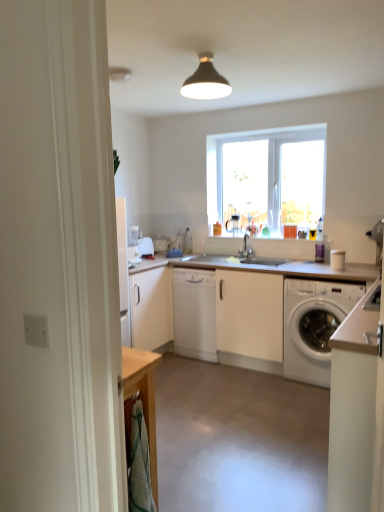
Question: Is white matte cabinet at center, which is counted as the second cabinetry, starting from the right, taller than white matte countertop at center?

Choices:
 (A) yes
 (B) no

Answer: (B)

Question: From a real-world perspective, is white matte cabinet at center, which is the 2th cabinetry from front to back, beneath white matte countertop at center?

Choices:
 (A) yes
 (B) no

Answer: (A)

Question: Is white matte cabinet at center, the first cabinetry from the back, closer to camera compared to white matte countertop at center?

Choices:
 (A) yes
 (B) no

Answer: (B)

Question: Is the depth of white matte cabinet at center, which ranks as the 1th cabinetry in left-to-right order, greater than that of white matte countertop at center?

Choices:
 (A) yes
 (B) no

Answer: (A)

Question: Is white matte cabinet at center, which is counted as the second cabinetry, starting from the right, surrounding white matte countertop at center?

Choices:
 (A) yes
 (B) no

Answer: (B)

Question: Is point (200, 84) positioned closer to the camera than point (243, 239)?

Choices:
 (A) closer
 (B) farther

Answer: (A)

Question: In terms of size, does matte black lampshade at upper center appear bigger or smaller than silver metallic faucet at center?

Choices:
 (A) big
 (B) small

Answer: (A)

Question: From the image's perspective, is matte black lampshade at upper center positioned above or below silver metallic faucet at center?

Choices:
 (A) above
 (B) below

Answer: (A)

Question: Is matte black lampshade at upper center to the left or to the right of silver metallic faucet at center in the image?

Choices:
 (A) left
 (B) right

Answer: (A)

Question: Which is correct: silver metallic faucet at center is inside white matte cabinet at center, which is the 2th cabinetry from front to back, or outside of it?

Choices:
 (A) outside
 (B) inside

Answer: (A)

Question: From a real-world perspective, is silver metallic faucet at center physically located above or below white matte cabinet at center, which ranks as the 1th cabinetry in left-to-right order?

Choices:
 (A) above
 (B) below

Answer: (A)

Question: Would you say silver metallic faucet at center is to the left or to the right of white matte cabinet at center, which is counted as the second cabinetry, starting from the right, in the picture?

Choices:
 (A) right
 (B) left

Answer: (A)

Question: Is silver metallic faucet at center in front of or behind white matte cabinet at center, which is the 2th cabinetry from front to back, in the image?

Choices:
 (A) front
 (B) behind

Answer: (B)

Question: Visually, is white glossy microwave at upper left positioned to the left or to the right of white matte washing machine at lower right?

Choices:
 (A) left
 (B) right

Answer: (A)

Question: From a real-world perspective, relative to white matte washing machine at lower right, is white glossy microwave at upper left vertically above or below?

Choices:
 (A) above
 (B) below

Answer: (A)